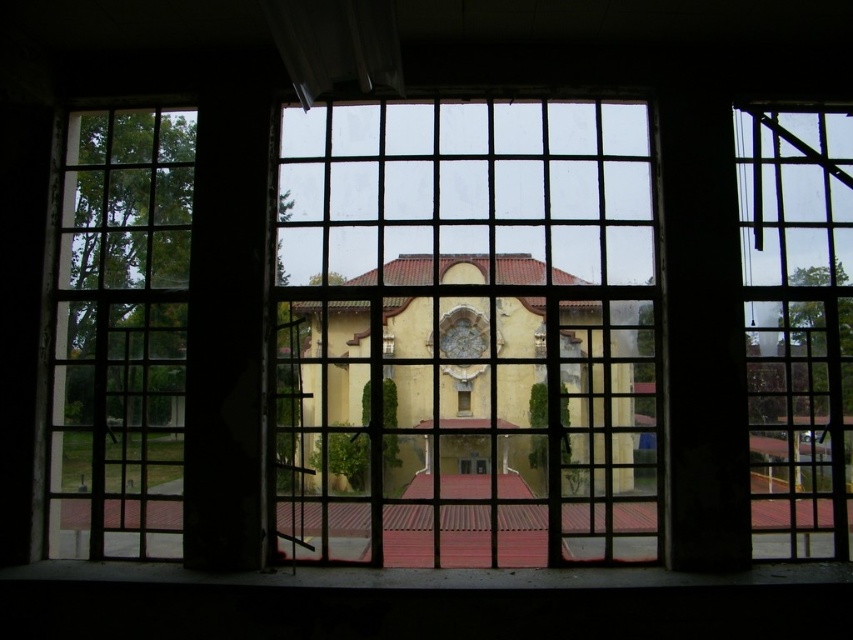
You are standing 2 meters away from the point at point (589, 109). If you walk straight towards it, will you reach it before walking 3 meters?

Yes, because you are only 2 meters away from the point at point (589, 109), and you need to walk less than 3 meters to reach it.

You are an architect designing a new building. You have two clear glass windows to place in a wall. The clear glass window at center and the clear glass window at left. Which window should you choose if you want the larger one to be at the center of the wall?

You should choose the clear glass window at center because it is bigger than the clear glass window at left, making it suitable for placement at the center of the wall.